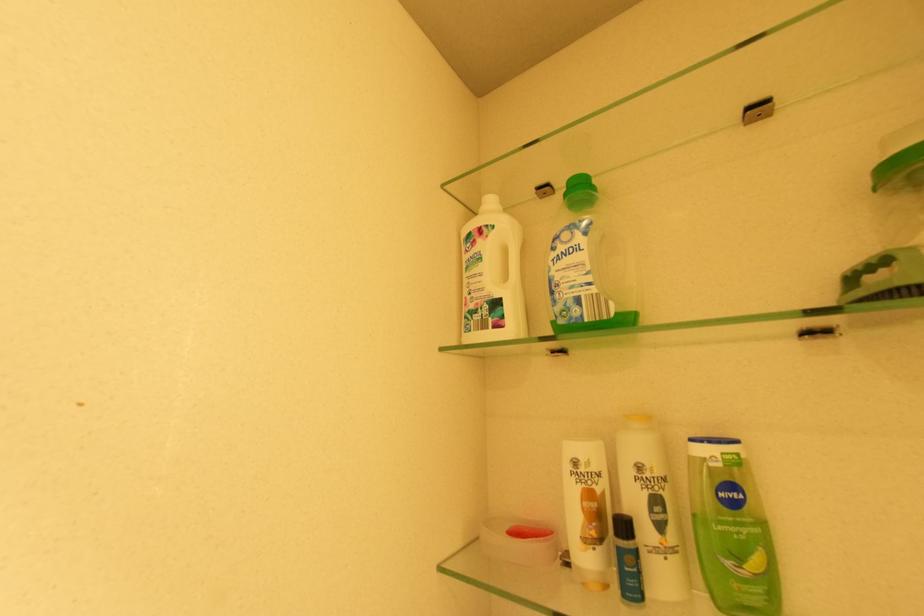
The image size is (924, 616). Identify the location of clear bottle handle. (624, 261).